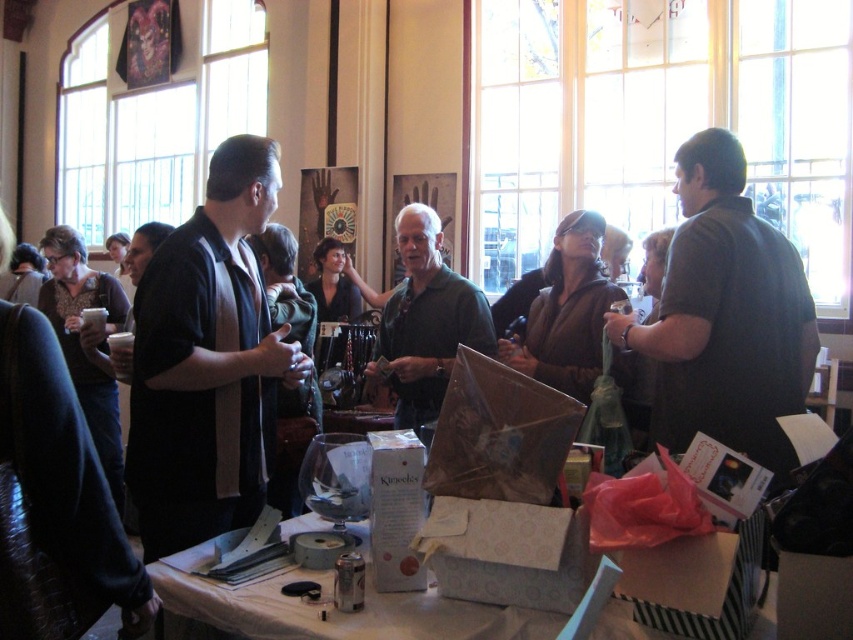
Which is more to the right, dark green shirt at upper right or clear glass wine glass at center?

From the viewer's perspective, dark green shirt at upper right appears more on the right side.

Can you confirm if dark green shirt at upper right is positioned to the right of clear glass wine glass at center?

Yes, dark green shirt at upper right is to the right of clear glass wine glass at center.

Which is in front, point (672, 369) or point (325, 474)?

Point (325, 474) is in front.

Identify the location of dark green shirt at upper right. This screenshot has width=853, height=640. (726, 316).

Does white cardboard boxes at center have a larger size compared to green matte shirt at center?

Correct, white cardboard boxes at center is larger in size than green matte shirt at center.

Between point (438, 636) and point (405, 259), which one is positioned behind?

The point (405, 259) is behind.

Does point (358, 628) come closer to viewer compared to point (415, 380)?

Yes.

Find the location of `white cardboard boxes at center`. white cardboard boxes at center is located at coordinates (338, 612).

Does dark green shirt at upper right have a lesser width compared to white cardboard boxes at center?

Yes, dark green shirt at upper right is thinner than white cardboard boxes at center.

Which is more to the right, dark green shirt at upper right or white cardboard boxes at center?

dark green shirt at upper right is more to the right.

Measure the distance between point [695,312] and camera.

Point [695,312] is 2.37 meters away from camera.

Locate an element on the screen. The image size is (853, 640). dark green shirt at upper right is located at coordinates (726, 316).